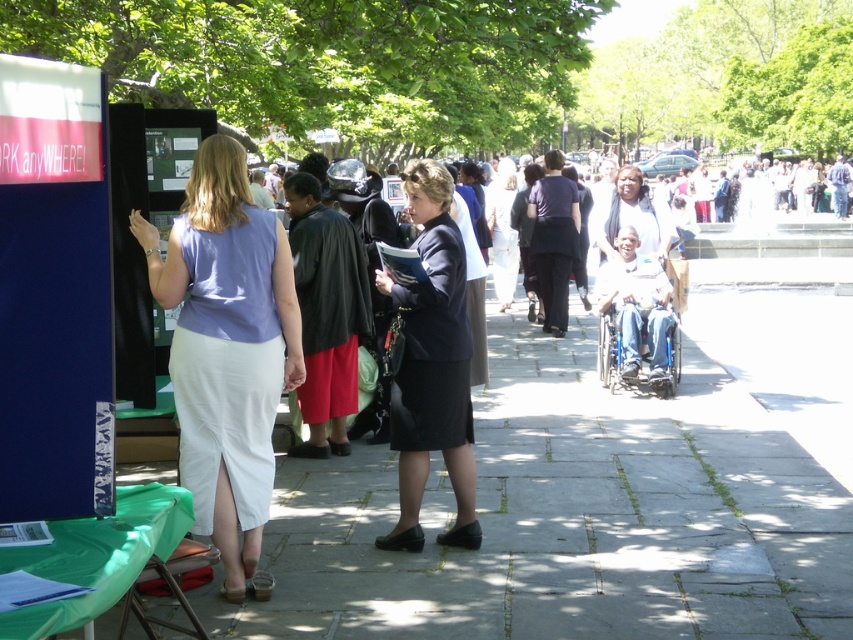
Question: Among these objects, which one is nearest to the camera?

Choices:
 (A) matte purple blouse at center
 (B) black fabric skirt at center

Answer: (A)

Question: Which object is the farthest from the matte purple blouse at center?

Choices:
 (A) black fabric skirt at center
 (B) white cotton shirt at center

Answer: (B)

Question: Does black fabric skirt at center have a greater width compared to white cotton shirt at center?

Choices:
 (A) yes
 (B) no

Answer: (B)

Question: Which is farther from the matte purple blouse at center?

Choices:
 (A) white cotton shirt at center
 (B) black fabric skirt at center

Answer: (A)

Question: Can you confirm if black fabric skirt at center is positioned to the right of white cotton shirt at center?

Choices:
 (A) yes
 (B) no

Answer: (B)

Question: Can you confirm if matte purple blouse at center is positioned above white cotton shirt at center?

Choices:
 (A) no
 (B) yes

Answer: (A)